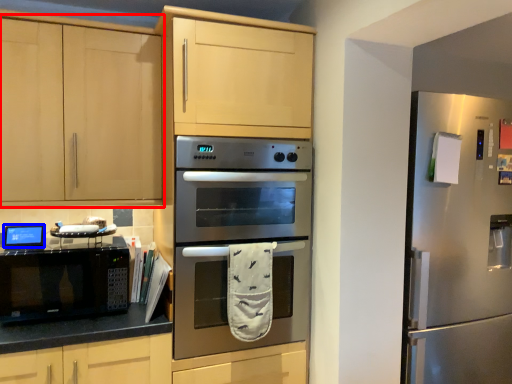
Question: Which of the following is the farthest to the observer, cabinetry (highlighted by a red box) or appliance (highlighted by a blue box)?

Choices:
 (A) cabinetry
 (B) appliance

Answer: (B)